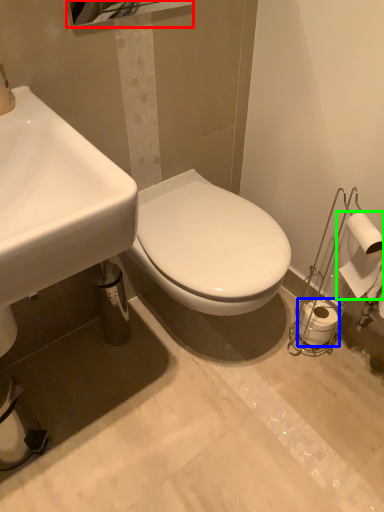
Question: Which object is positioned closest to mirror (highlighted by a red box)? Select from toilet paper (highlighted by a blue box) and toilet paper (highlighted by a green box).

Choices:
 (A) toilet paper
 (B) toilet paper

Answer: (B)